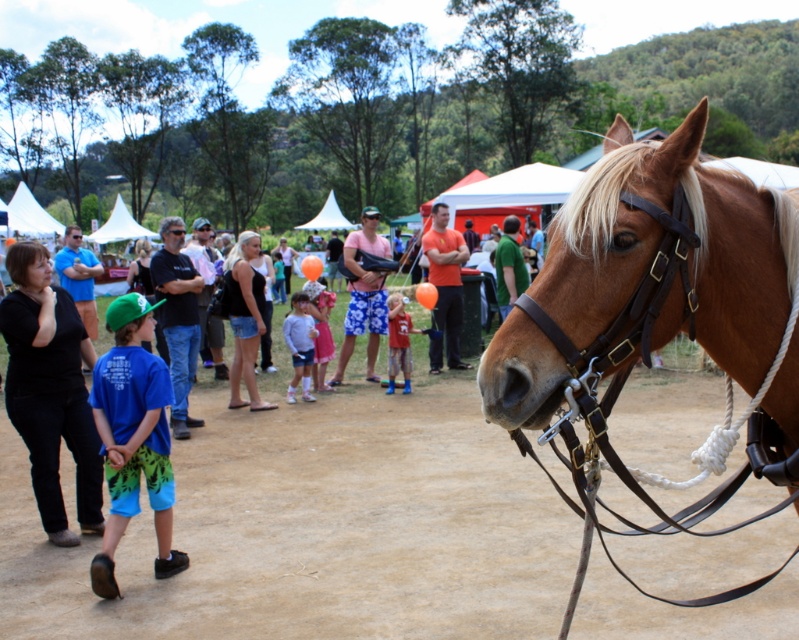
Question: Which of the following is the closest to the observer?

Choices:
 (A) orange cotton shirt at center
 (B) light pink fabric dress at center
 (C) black denim shorts at center

Answer: (C)

Question: Can you confirm if brown dirt field at center is wider than light pink fabric dress at center?

Choices:
 (A) no
 (B) yes

Answer: (B)

Question: Is blue fabric shorts at lower left below green fabric shirt at center?

Choices:
 (A) no
 (B) yes

Answer: (B)

Question: Which point is closer to the camera?

Choices:
 (A) (505, 278)
 (B) (46, 291)
 (C) (253, 312)
 (D) (360, 296)

Answer: (B)

Question: Among these points, which one is farthest from the camera?

Choices:
 (A) (340, 356)
 (B) (293, 384)
 (C) (149, 477)

Answer: (A)

Question: In this image, where is floral shorts at center located relative to matte blue shirt at center?

Choices:
 (A) left
 (B) right

Answer: (A)